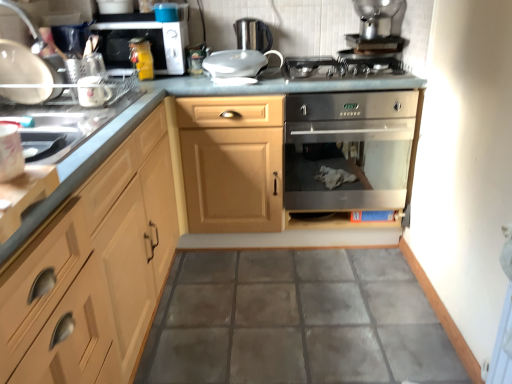
Question: In the image, is stainless steel gas stove at center on the left side or the right side of light wood cabinet at left?

Choices:
 (A) left
 (B) right

Answer: (B)

Question: Considering the positions of stainless steel gas stove at center and light wood cabinet at left in the image, is stainless steel gas stove at center taller or shorter than light wood cabinet at left?

Choices:
 (A) tall
 (B) short

Answer: (B)

Question: Estimate the real-world distances between objects in this image. Which object is closer to the light wood cabinet at left?

Choices:
 (A) satin silver kettle at upper center, the first appliance when ordered from back to front
 (B) white glossy mug at upper left, which appears as the 4th appliance when viewed from the top
 (C) gray tile floor at center
 (D) stainless steel gas stove at center
 (E) white glossy mug at left, marked as the 1th appliance in a bottom-to-top arrangement

Answer: (E)

Question: Estimate the real-world distances between objects in this image. Which object is closer to the white glossy mug at left, acting as the first appliance starting from the front?

Choices:
 (A) stainless steel oven at center
 (B) stainless steel oven at center
 (C) white glossy mug at upper left, marked as the second appliance in a front-to-back arrangement
 (D) light wood cabinet at left
 (E) stainless steel gas stove at center

Answer: (D)